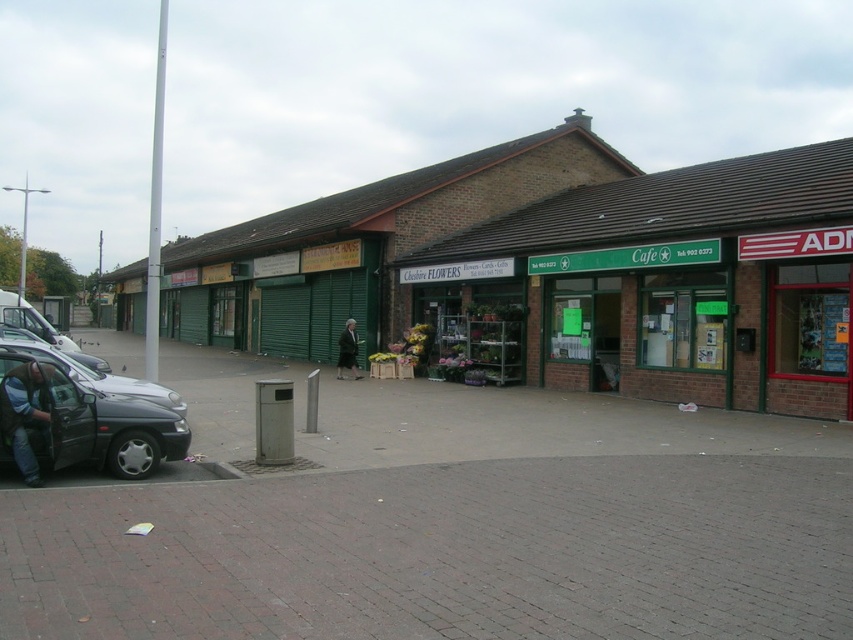
Question: Is denim jacket at lower left smaller than dark green coat at center?

Choices:
 (A) no
 (B) yes

Answer: (B)

Question: Which is farther from the shiny silver car at left?

Choices:
 (A) denim jacket at lower left
 (B) dark green coat at center

Answer: (B)

Question: Which of these objects is positioned closest to the dark green coat at center?

Choices:
 (A) shiny silver car at left
 (B) matte black van at lower left

Answer: (A)

Question: Is denim jacket at lower left closer to camera compared to dark green coat at center?

Choices:
 (A) no
 (B) yes

Answer: (B)

Question: Can you confirm if denim jacket at lower left is bigger than shiny silver car at left?

Choices:
 (A) no
 (B) yes

Answer: (B)

Question: Which of the following is the closest to the observer?

Choices:
 (A) (32, 428)
 (B) (341, 332)
 (C) (21, 456)
 (D) (137, 385)

Answer: (C)